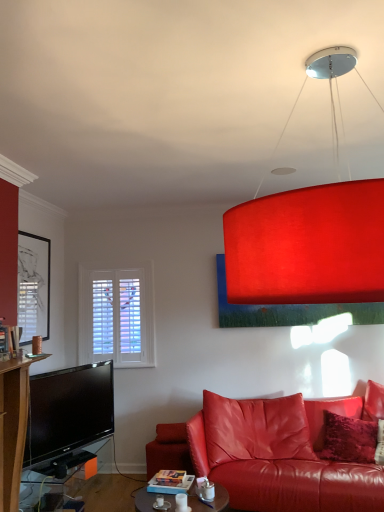
Question: In terms of height, does velvet red pillow at lower right look taller or shorter compared to matte black picture frame at left?

Choices:
 (A) short
 (B) tall

Answer: (A)

Question: Is velvet red pillow at lower right inside the boundaries of matte black picture frame at left, or outside?

Choices:
 (A) outside
 (B) inside

Answer: (A)

Question: Estimate the real-world distances between objects in this image. Which object is closer to the velvet red pillow at lower right?

Choices:
 (A) matte black tv stand at lower left, which appears as the first table when viewed from the left
 (B) matte leather couch at lower right
 (C) matte red lampshade at upper center
 (D) matte black picture frame at left
 (E) matte glass coffee table at center, the 2th table when ordered from left to right

Answer: (B)

Question: Which of these objects is positioned farthest from the matte glass coffee table at center, marked as the 1th table in a right-to-left arrangement?

Choices:
 (A) matte black tv stand at lower left, the second table viewed from the right
 (B) velvet red pillow at lower right
 (C) matte black picture frame at left
 (D) matte leather couch at lower right
 (E) matte red lampshade at upper center

Answer: (E)